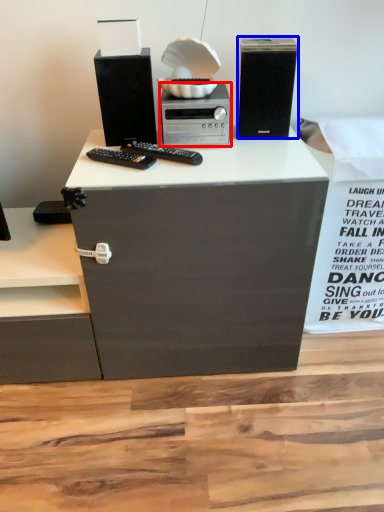
Question: Which object is further to the camera taking this photo, home appliance (highlighted by a red box) or computer tower (highlighted by a blue box)?

Choices:
 (A) home appliance
 (B) computer tower

Answer: (A)